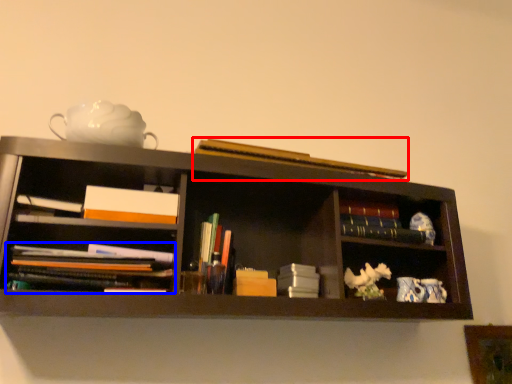
Question: Which object is further to the camera taking this photo, book (highlighted by a red box) or book (highlighted by a blue box)?

Choices:
 (A) book
 (B) book

Answer: (A)